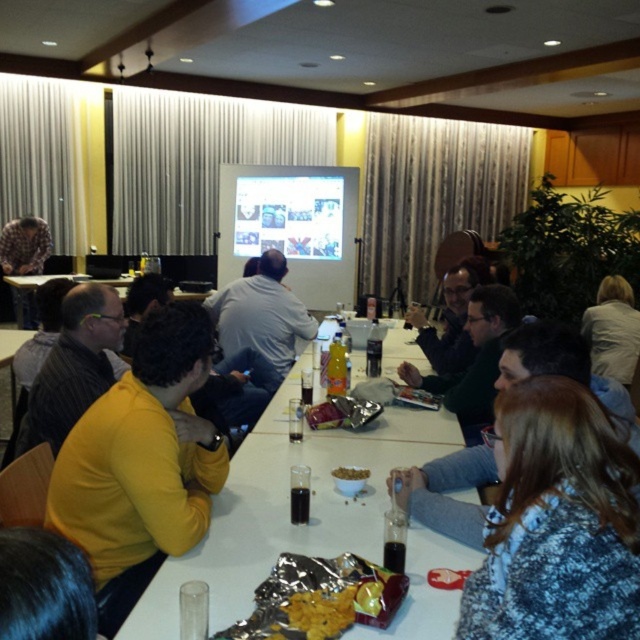
Can you confirm if white glossy table at center is positioned above white fabric shirt at upper right?

No, white glossy table at center is not above white fabric shirt at upper right.

Is white glossy table at center bigger than white fabric shirt at upper right?

Indeed, white glossy table at center has a larger size compared to white fabric shirt at upper right.

This screenshot has height=640, width=640. I want to click on white glossy table at center, so click(x=289, y=508).

Which is more to the right, light gray shirt at center or brown matte bowl at center?

From the viewer's perspective, brown matte bowl at center appears more on the right side.

Between point (282, 285) and point (353, 477), which one is positioned behind?

Point (282, 285)

Find the location of a particular element. light gray shirt at center is located at coordinates (260, 314).

Between point (51, 448) and point (365, 474), which one is positioned in front?

Positioned in front is point (365, 474).

Does matte black shirt at left come in front of brown matte bowl at center?

No, it is not.

Does point (52, 368) lie in front of point (365, 470)?

No, it is behind (365, 470).

Locate an element on the screen. This screenshot has height=640, width=640. matte black shirt at left is located at coordinates (74, 365).